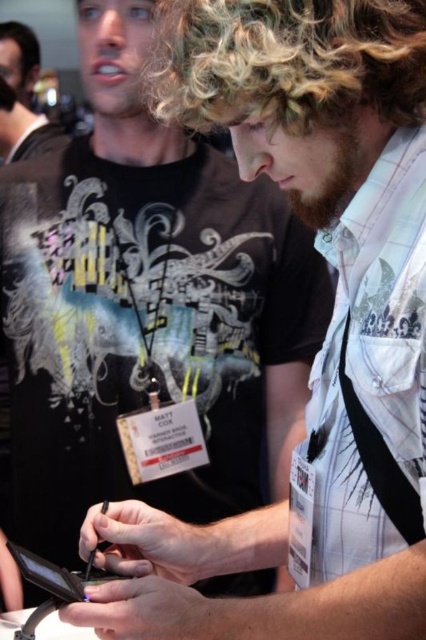
Can you confirm if matte black shirt at upper left is wider than black matte smartphone at lower left?

Yes.

Does matte black shirt at upper left have a larger size compared to black matte smartphone at lower left?

Correct, matte black shirt at upper left is larger in size than black matte smartphone at lower left.

Describe the element at coordinates (22, 97) in the screenshot. I see `matte black shirt at upper left` at that location.

Identify the location of matte black shirt at upper left. This screenshot has width=426, height=640. (22, 97).

Does point (36, 556) lie in front of point (37, 54)?

Yes, it is.

Is point (65, 589) behind point (19, 22)?

No, (65, 589) is closer to viewer.

At what (x,y) coordinates should I click in order to perform the action: click on black matte smartphone at lower left. Please return your answer as a coordinate pair (x, y). This screenshot has width=426, height=640. Looking at the image, I should click on (48, 576).

Is white textured shirt at center smaller than dark brown curly hair at upper left?

Incorrect, white textured shirt at center is not smaller in size than dark brown curly hair at upper left.

Does white textured shirt at center have a larger size compared to dark brown curly hair at upper left?

Yes.

At what (x,y) coordinates should I click in order to perform the action: click on white textured shirt at center. Please return your answer as a coordinate pair (x, y). This screenshot has width=426, height=640. Looking at the image, I should click on (146, 308).